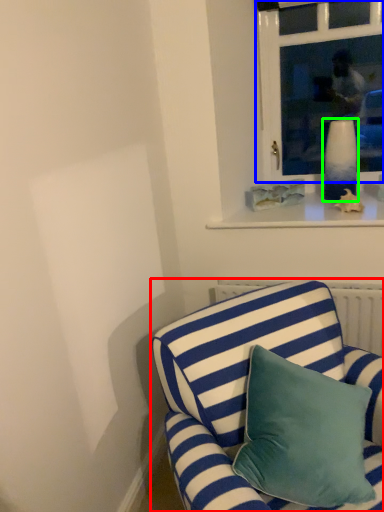
Question: Which object is the closest to the studio couch (highlighted by a red box)? Choose among these: window (highlighted by a blue box) or vase (highlighted by a green box).

Choices:
 (A) window
 (B) vase

Answer: (B)